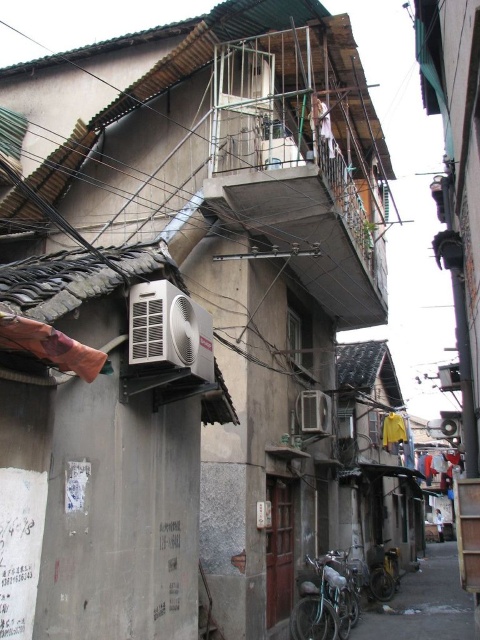
Question: Which point is closer to the camera?

Choices:
 (A) (459, 387)
 (B) (327, 410)

Answer: (A)

Question: Estimate the real-world distances between objects in this image. Which object is closer to the silver metallic air conditioner at center?

Choices:
 (A) white plastic air conditioner at lower right
 (B) white plastic air conditioner at upper center

Answer: (B)

Question: Can you confirm if silver metallic air conditioner at center is positioned to the left of white plastic air conditioner at upper center?

Choices:
 (A) no
 (B) yes

Answer: (B)

Question: Can you confirm if silver metallic air conditioner at center is positioned to the left of white plastic air conditioner at upper center?

Choices:
 (A) no
 (B) yes

Answer: (B)

Question: Which of these objects is positioned farthest from the white plastic air conditioner at lower right?

Choices:
 (A) white plastic air conditioner at upper center
 (B) silver metallic air conditioner at center

Answer: (B)

Question: In this image, where is silver metallic air conditioner at center located relative to white plastic air conditioner at upper center?

Choices:
 (A) left
 (B) right

Answer: (A)